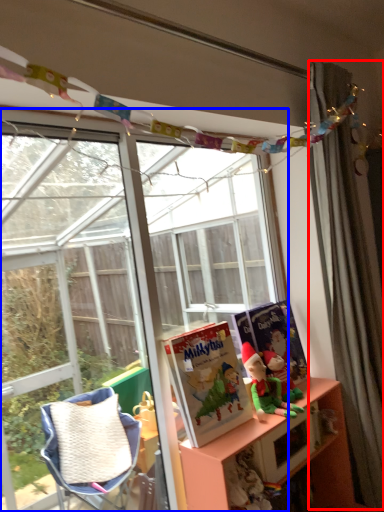
Question: Which point is closer to the camera, curtain (highlighted by a red box) or window (highlighted by a blue box)?

Choices:
 (A) curtain
 (B) window

Answer: (B)